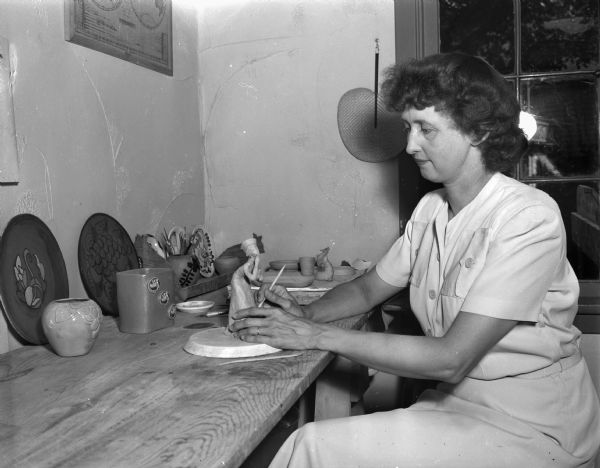
The image size is (600, 468). In order to click on wall in this screenshot , I will do `click(136, 133)`, `click(294, 128)`.